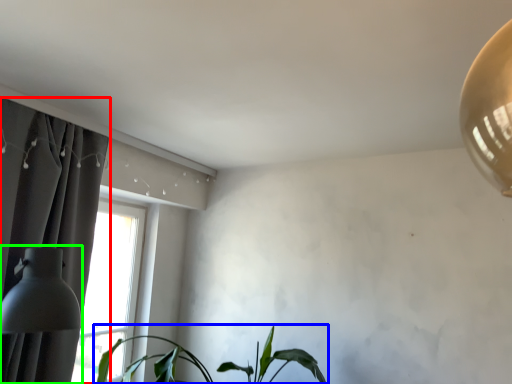
Question: Considering the real-world distances, which object is farthest from curtain (highlighted by a red box)? houseplant (highlighted by a blue box) or table lamp (highlighted by a green box)?

Choices:
 (A) houseplant
 (B) table lamp

Answer: (A)